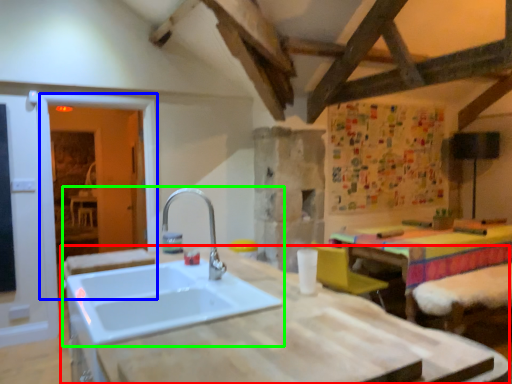
Question: Which is nearer to the countertop (highlighted by a red box)? glass door (highlighted by a blue box) or sink (highlighted by a green box).

Choices:
 (A) glass door
 (B) sink

Answer: (B)